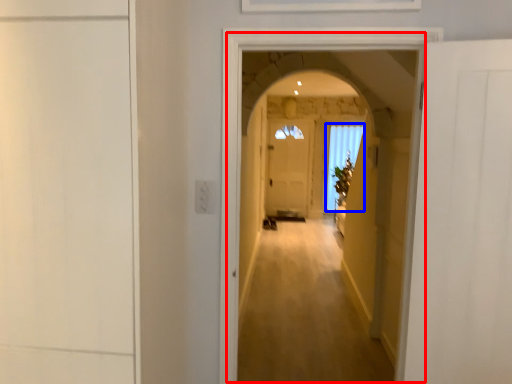
Question: Which of the following is the closest to the observer, corridor (highlighted by a red box) or window (highlighted by a blue box)?

Choices:
 (A) corridor
 (B) window

Answer: (A)